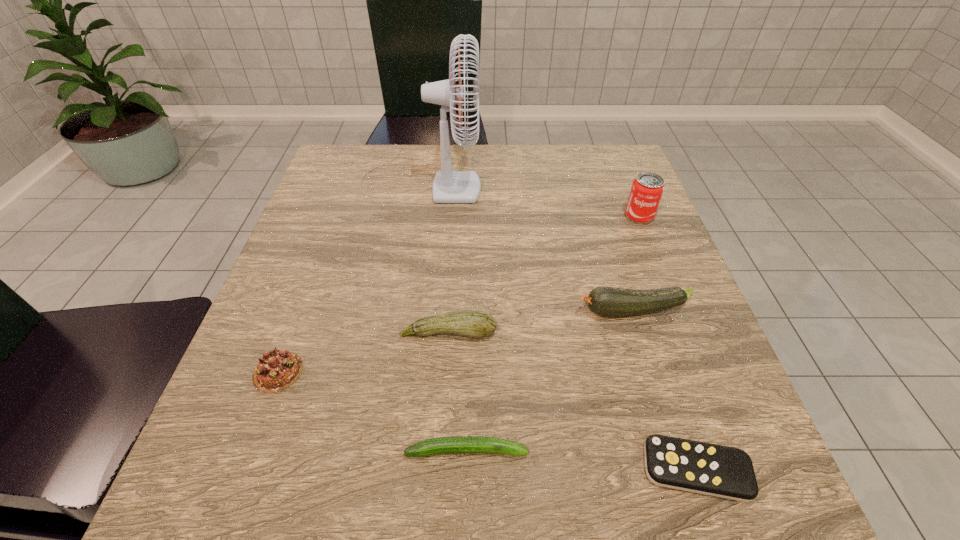
Identify the location of vacant space at the right edge. (604, 248).

Identify the location of free space at the far right corner of the desktop. The width and height of the screenshot is (960, 540). (587, 184).

Find the location of `unoccupied position between the tallest object and the second tallest object`. unoccupied position between the tallest object and the second tallest object is located at coordinates (531, 196).

This screenshot has height=540, width=960. Identify the location of free area in between the second tallest zucchini and the third shortest object. (363, 352).

The width and height of the screenshot is (960, 540). Find the location of `vacant space that's between the second shortest zucchini and the rightmost zucchini`. vacant space that's between the second shortest zucchini and the rightmost zucchini is located at coordinates (540, 322).

Where is `free space between the can and the remote control`? free space between the can and the remote control is located at coordinates (668, 342).

At what (x,y) coordinates should I click in order to perform the action: click on unoccupied area between the can and the nearest zucchini. Please return your answer as a coordinate pair (x, y). The height and width of the screenshot is (540, 960). Looking at the image, I should click on (553, 333).

At what (x,y) coordinates should I click in order to perform the action: click on free space between the rightmost zucchini and the remote control. Please return your answer as a coordinate pair (x, y). Looking at the image, I should click on (664, 390).

Where is `vacant space that's between the fourth tallest object and the rightmost zucchini`? Image resolution: width=960 pixels, height=540 pixels. vacant space that's between the fourth tallest object and the rightmost zucchini is located at coordinates (540, 322).

You are a GUI agent. You are given a task and a screenshot of the screen. Output one action in this format:
    pyautogui.click(x=<x>, y=<y>)
    Task: Click on the unoccupied area between the remote control and the chocolate cake
    The width and height of the screenshot is (960, 540).
    Given the screenshot: What is the action you would take?
    pyautogui.click(x=487, y=421)